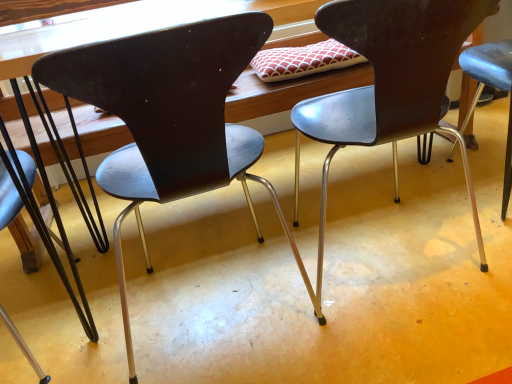
At what (x,y) coordinates should I click in order to perform the action: click on free location to the right of metallic black chair at center, which is the 3th chair from left to right. Please return your answer as a coordinate pair (x, y). The height and width of the screenshot is (384, 512). Looking at the image, I should click on (467, 216).